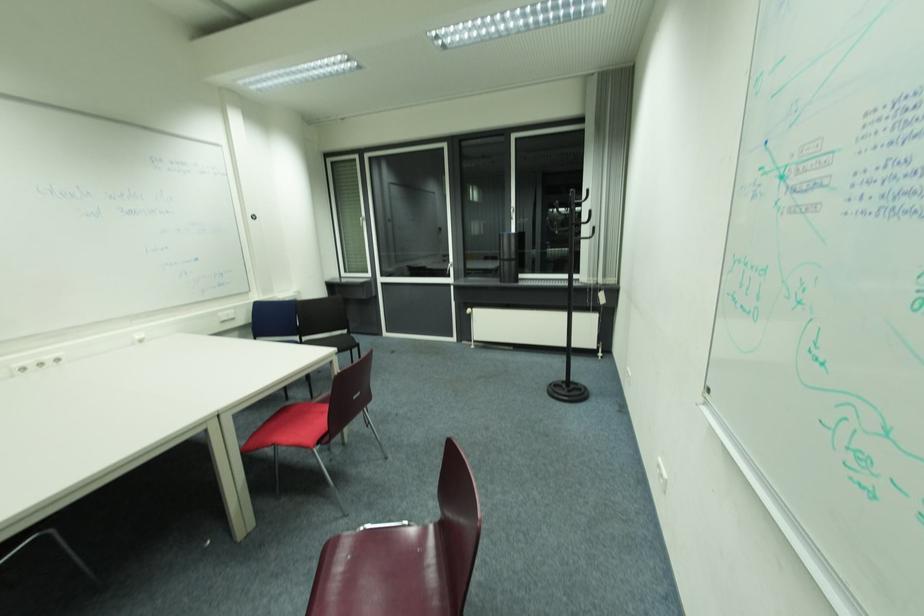
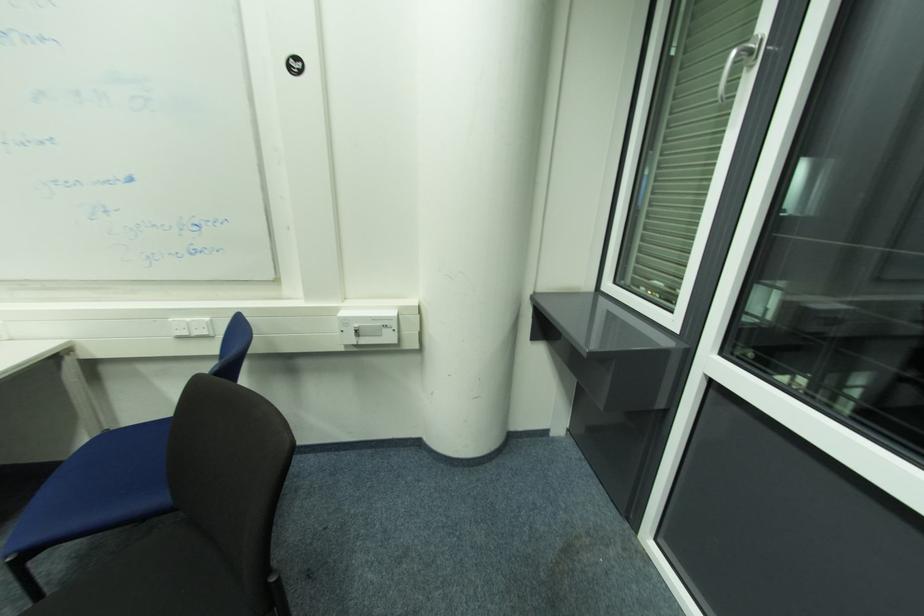
In the second image, find the point that corresponds to the point at 296,297 in the first image.

(378, 320)